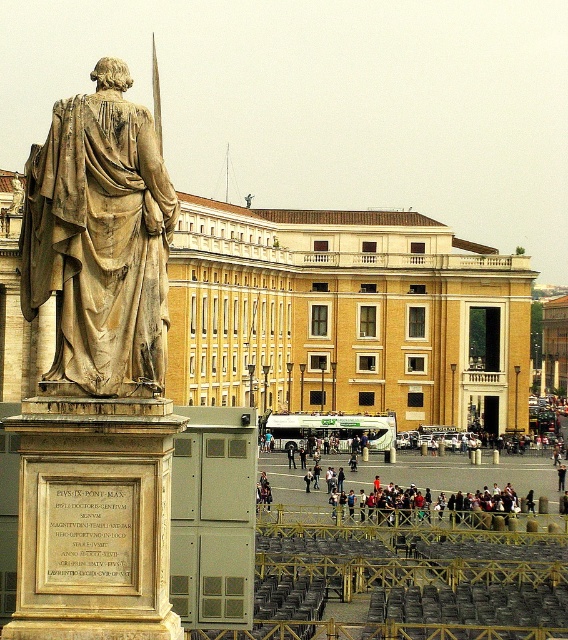
Question: Which is nearer to the dark gray fabric jacket at center?

Choices:
 (A) beige stone building at center
 (B) stone statue at upper left

Answer: (B)

Question: In this image, where is beige stone building at center located relative to stone statue at upper left?

Choices:
 (A) below
 (B) above

Answer: (A)

Question: Is stone statue at upper left above dark gray fabric jacket at center?

Choices:
 (A) no
 (B) yes

Answer: (B)

Question: Which of the following is the farthest from the observer?

Choices:
 (A) (186, 310)
 (B) (417, 515)
 (C) (94, 67)

Answer: (A)

Question: Based on their relative distances, which object is nearer to the dark gray fabric jacket at center?

Choices:
 (A) beige stone building at center
 (B) stone statue at upper left

Answer: (B)

Question: Is beige stone building at center further to the viewer compared to dark gray fabric jacket at center?

Choices:
 (A) no
 (B) yes

Answer: (A)